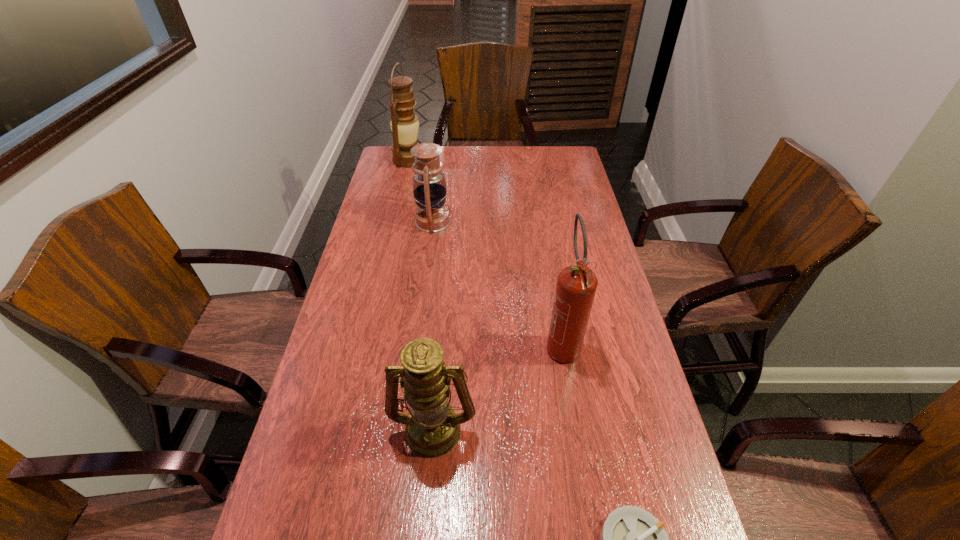
At what (x,y) coordinates should I click in order to perform the action: click on vacant region between the fourth farthest object and the fire extinguisher. Please return your answer as a coordinate pair (x, y). This screenshot has height=540, width=960. Looking at the image, I should click on (497, 385).

The image size is (960, 540). In order to click on the third closest object to the ashtray in this screenshot , I will do `click(429, 186)`.

Select which object is the fourth closest to the fire extinguisher. Please provide its 2D coordinates. Your answer should be formatted as a tuple, i.e. [(x, y)], where the tuple contains the x and y coordinates of a point satisfying the conditions above.

[(404, 124)]

Locate which oil lamp ranks in proximity to the farthest object. Please provide its 2D coordinates. Your answer should be formatted as a tuple, i.e. [(x, y)], where the tuple contains the x and y coordinates of a point satisfying the conditions above.

[(429, 186)]

Locate an element on the screen. oil lamp that stands as the closest to the leftmost object is located at coordinates (429, 186).

This screenshot has width=960, height=540. Identify the location of vacant space that satisfies the following two spatial constraints: 1. on the front side of the fourth farthest object; 2. on the right side of the tallest oil lamp. (347, 427).